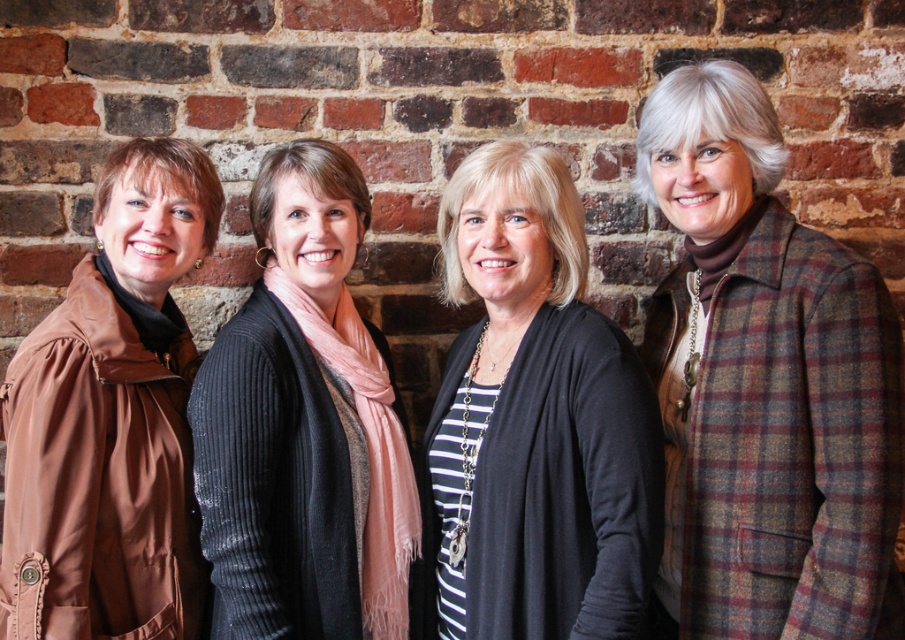
Question: Among these points, which one is nearest to the camera?

Choices:
 (A) (350, 253)
 (B) (159, 557)
 (C) (855, 589)

Answer: (C)

Question: Can you confirm if black knit cardigan at center is bigger than brown leather jacket at left?

Choices:
 (A) yes
 (B) no

Answer: (A)

Question: Which point is closer to the camera?

Choices:
 (A) (280, 204)
 (B) (58, 403)
 (C) (500, 404)

Answer: (B)

Question: Is black ribbed sweater at center closer to camera compared to brown leather jacket at left?

Choices:
 (A) no
 (B) yes

Answer: (A)

Question: Which object appears closest to the camera in this image?

Choices:
 (A) black knit cardigan at center
 (B) black ribbed sweater at center

Answer: (A)

Question: Can you confirm if black ribbed sweater at center is positioned below brown leather jacket at left?

Choices:
 (A) yes
 (B) no

Answer: (A)